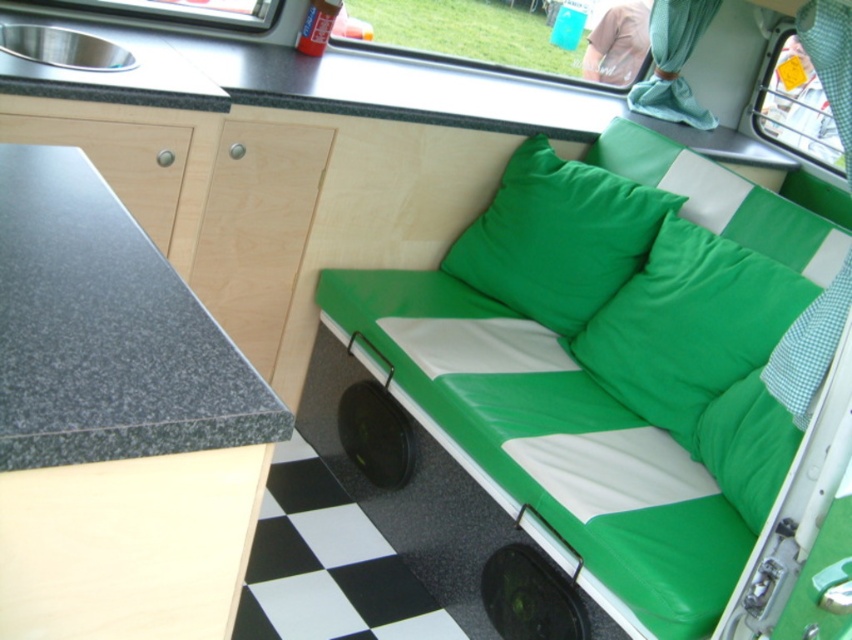
Is green fabric pillow at center to the right of green fabric pillow at upper right from the viewer's perspective?

Indeed, green fabric pillow at center is positioned on the right side of green fabric pillow at upper right.

Based on the photo, between green fabric pillow at center and green fabric pillow at upper right, which one has less height?

green fabric pillow at upper right is shorter.

Between point (743, 248) and point (527, 248), which one is positioned behind?

The point (527, 248) is behind.

What are the coordinates of `green fabric pillow at center` in the screenshot? It's located at (688, 324).

Can you confirm if granite countertop at left is taller than green fabric pillow at upper right?

In fact, granite countertop at left may be shorter than green fabric pillow at upper right.

Is point (119, 372) closer to viewer compared to point (505, 243)?

Yes.

Between point (93, 173) and point (550, 269), which one is positioned in front?

Positioned in front is point (93, 173).

Find the location of a particular element. granite countertop at left is located at coordinates (106, 332).

Who is positioned more to the right, granite countertop at left or green fabric pillow at center?

From the viewer's perspective, green fabric pillow at center appears more on the right side.

Can you confirm if granite countertop at left is thinner than green fabric pillow at center?

Yes.

Measure the distance between point (x=18, y=246) and camera.

The distance of point (x=18, y=246) from camera is 37.38 inches.

Identify the location of granite countertop at left. (106, 332).